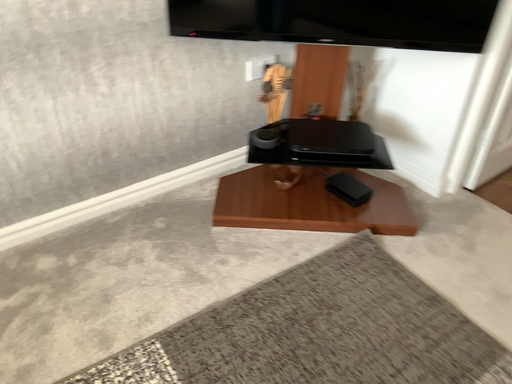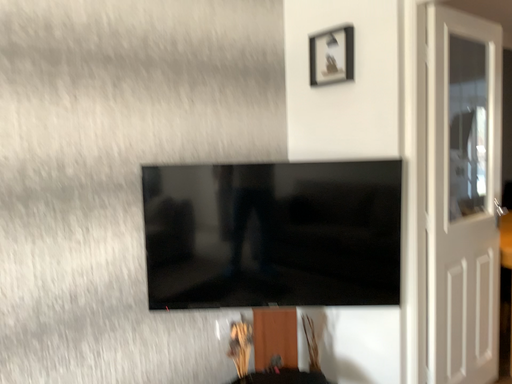
Question: Which way did the camera rotate in the video?

Choices:
 (A) rotated upward
 (B) rotated downward

Answer: (A)